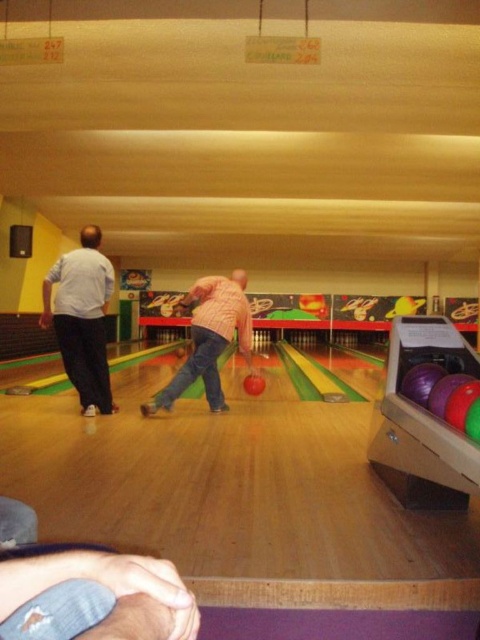
Consider the image. You are standing at the front of the bowling lane and want to determine which of the two points, point [86,413] or point [187,360], is closer to you. Based on the scene description, which point is nearer?

Point [86,413] is closer to the viewer than point [187,360].

You are a spectator at the bowling alley and see the white matte shirt at left and the pink matte shirt at center. Which shirt is located more to the left side of the scene?

The white matte shirt at left is positioned on the left side of the pink matte shirt at center, so the white matte shirt at left is more to the left side of the scene.